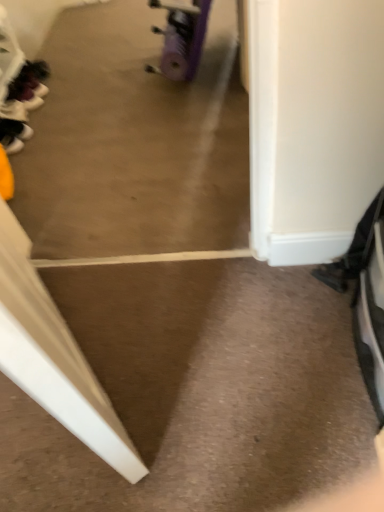
Question: Is matte black shoe at left, the first footwear viewed from the top, closer to the viewer compared to purple rubber wheel at center?

Choices:
 (A) no
 (B) yes

Answer: (A)

Question: Can you confirm if matte black shoe at left, the first footwear when ordered from back to front, is wider than purple rubber wheel at center?

Choices:
 (A) no
 (B) yes

Answer: (B)

Question: Does matte black shoe at left, the first footwear viewed from the top, turn towards purple rubber wheel at center?

Choices:
 (A) no
 (B) yes

Answer: (B)

Question: Is matte black shoe at left, the first footwear viewed from the top, taller than purple rubber wheel at center?

Choices:
 (A) yes
 (B) no

Answer: (B)

Question: Can you confirm if matte black shoe at left, the first footwear when ordered from back to front, is smaller than purple rubber wheel at center?

Choices:
 (A) no
 (B) yes

Answer: (B)

Question: Considering their positions, is matte black shoe at left, which appears as the second footwear when ordered from the bottom, located in front of or behind purple rubber wheel at center?

Choices:
 (A) front
 (B) behind

Answer: (B)

Question: From their relative heights in the image, would you say matte black shoe at left, the first footwear viewed from the top, is taller or shorter than purple rubber wheel at center?

Choices:
 (A) tall
 (B) short

Answer: (B)

Question: Is point (14, 100) closer or farther from the camera than point (198, 29)?

Choices:
 (A) farther
 (B) closer

Answer: (A)

Question: Is matte black shoe at left, which appears as the second footwear when viewed from the front, wider or thinner than purple rubber wheel at center?

Choices:
 (A) thin
 (B) wide

Answer: (B)

Question: Is purple rubber wheel at center taller or shorter than black matte shoe at left, which is counted as the 2th footwear, starting from the top?

Choices:
 (A) short
 (B) tall

Answer: (B)

Question: Is point (162, 68) positioned closer to the camera than point (0, 136)?

Choices:
 (A) closer
 (B) farther

Answer: (B)

Question: Looking at their shapes, would you say purple rubber wheel at center is wider or thinner than black matte shoe at left, which is counted as the 2th footwear, starting from the top?

Choices:
 (A) thin
 (B) wide

Answer: (A)

Question: From a real-world perspective, relative to black matte shoe at left, placed as the first footwear when sorted from front to back, is purple rubber wheel at center vertically above or below?

Choices:
 (A) above
 (B) below

Answer: (A)

Question: Is black matte shoe at left, which is counted as the 2th footwear, starting from the top, taller or shorter than matte black shoe at left, which appears as the second footwear when ordered from the bottom?

Choices:
 (A) tall
 (B) short

Answer: (A)

Question: Based on their positions, is black matte shoe at left, the 2th footwear positioned from the back, located to the left or right of matte black shoe at left, the first footwear viewed from the top?

Choices:
 (A) left
 (B) right

Answer: (B)